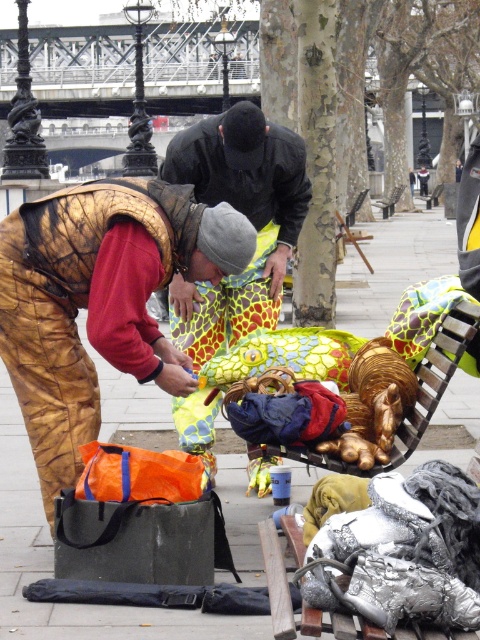
Question: Considering the real-world distances, which object is farthest from the orange fabric bag at lower left?

Choices:
 (A) camouflage fabric man at center
 (B) camouflage fabric street artist at left

Answer: (A)

Question: Which point is farther to the camera?

Choices:
 (A) camouflage fabric man at center
 (B) wooden bench at center
 (C) camouflage fabric street artist at left
 (D) orange fabric bag at lower left

Answer: (B)

Question: Can you confirm if camouflage fabric street artist at left is positioned below orange fabric bag at lower left?

Choices:
 (A) no
 (B) yes

Answer: (B)

Question: Which point is farther from the camera taking this photo?

Choices:
 (A) (199, 364)
 (B) (394, 202)
 (C) (410, 266)
 (D) (72, 221)

Answer: (B)

Question: Does camouflage fabric man at center appear over wooden bench at center?

Choices:
 (A) yes
 (B) no

Answer: (B)

Question: Does orange fabric bag at lower left appear on the right side of wooden bench at center?

Choices:
 (A) no
 (B) yes

Answer: (A)